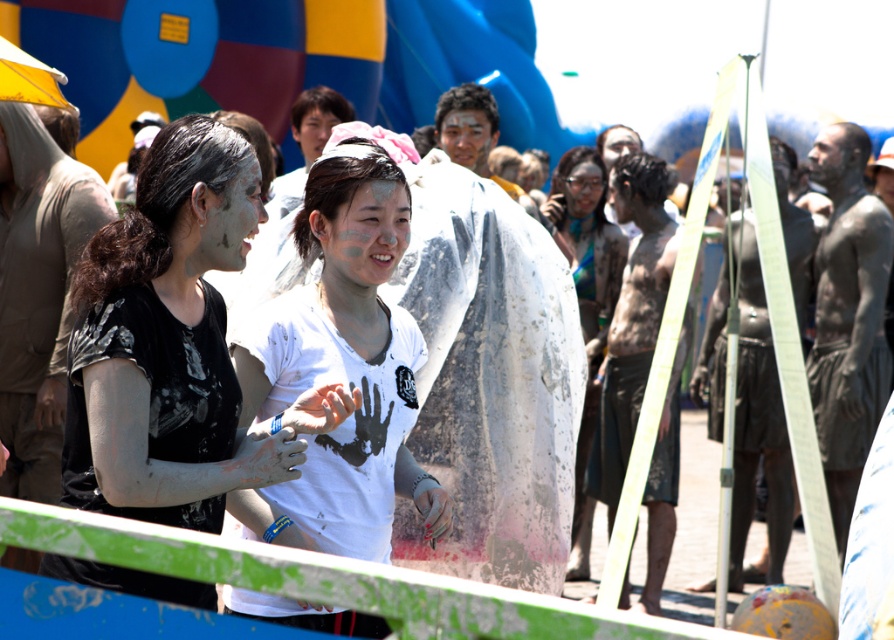
You are organizing a photo shoot at the mud run event and want to place the matte black shirt at center and the matte white dress at center in the foreground. Which of the two items should you place closer to the camera to ensure they appear the same size in the final photo?

To make the matte black shirt at center and the matte white dress at center appear the same size in the photo, place the smaller matte black shirt at center closer to the camera since it is smaller than the matte white dress at center.